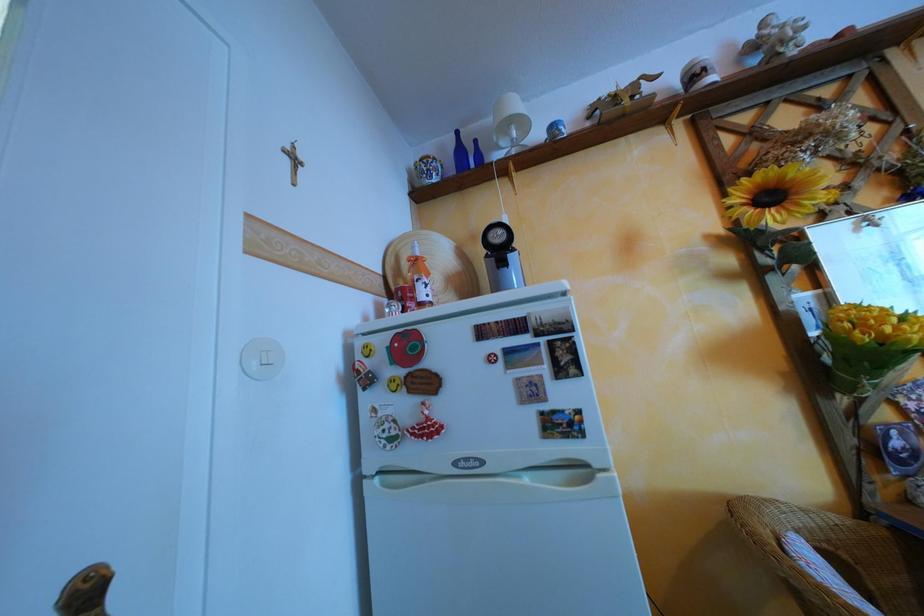
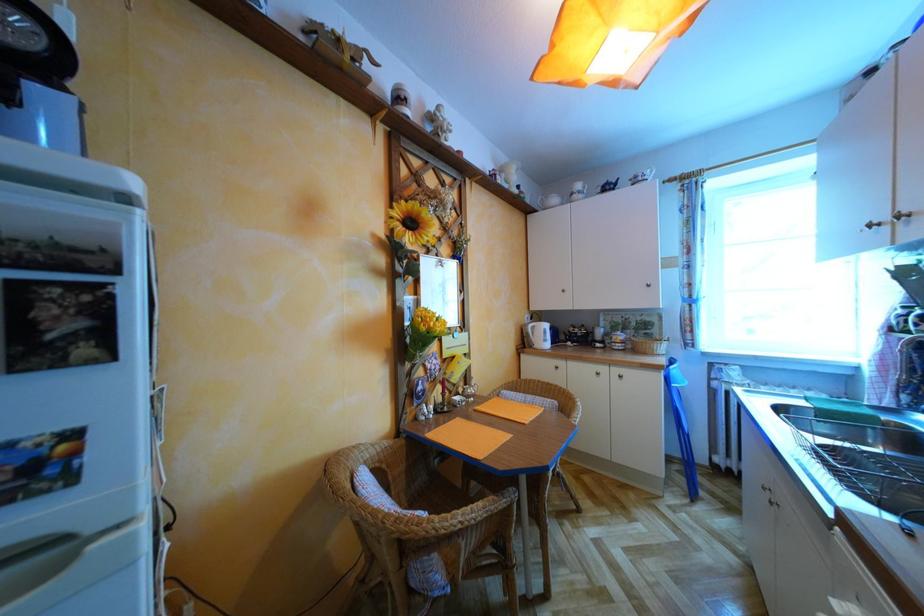
Question: How did the camera likely rotate?

Choices:
 (A) Left
 (B) Right
 (C) Up
 (D) Down

Answer: (B)